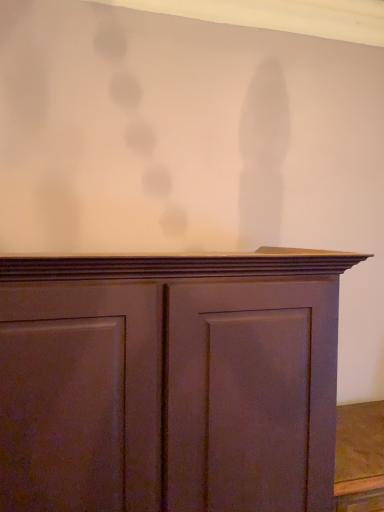
Locate an element on the screen. The height and width of the screenshot is (512, 384). matte wood cabinet at center is located at coordinates (169, 381).

Describe the element at coordinates (169, 381) in the screenshot. I see `matte wood cabinet at center` at that location.

Identify the location of matte wood cabinet at center. Image resolution: width=384 pixels, height=512 pixels. (169, 381).